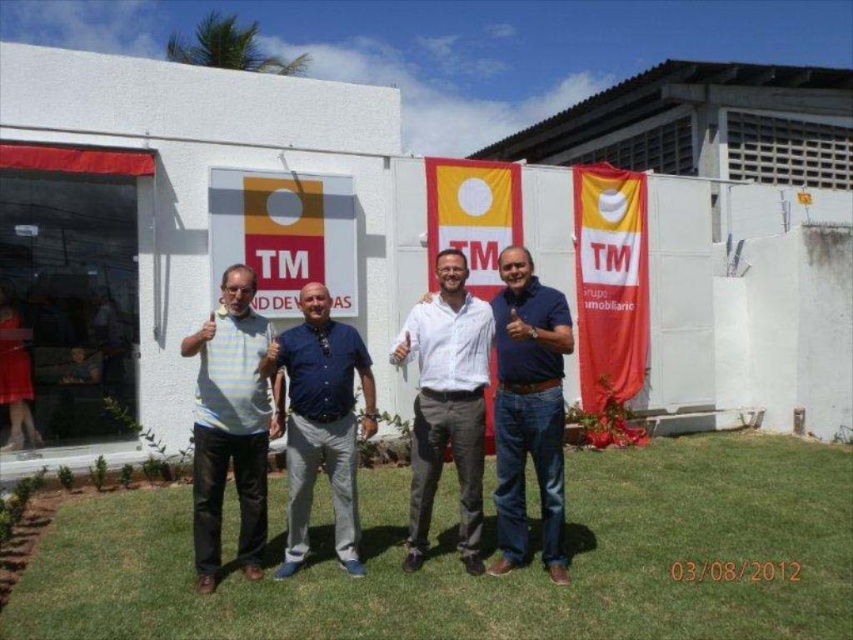
In the scene shown: Can you confirm if green grass at lower center is taller than white shirt at center?

In fact, green grass at lower center may be shorter than white shirt at center.

Who is more forward, (x=848, y=618) or (x=561, y=534)?

Point (x=848, y=618) is in front.

Image resolution: width=853 pixels, height=640 pixels. Identify the location of green grass at lower center. (489, 577).

Between green grass at lower center and white cotton shirt at center, which one appears on the right side from the viewer's perspective?

From the viewer's perspective, green grass at lower center appears more on the right side.

Is point (90, 593) less distant than point (409, 500)?

Yes, point (90, 593) is in front of point (409, 500).

Which is in front, point (734, 580) or point (410, 340)?

Positioned in front is point (734, 580).

At what (x,y) coordinates should I click in order to perform the action: click on green grass at lower center. Please return your answer as a coordinate pair (x, y). The image size is (853, 640). Looking at the image, I should click on (489, 577).

From the picture: Is striped cotton shirt at center bigger than white cotton shirt at center?

Indeed, striped cotton shirt at center has a larger size compared to white cotton shirt at center.

Who is more distant from viewer, (x=227, y=355) or (x=453, y=353)?

Point (x=453, y=353)

The image size is (853, 640). Find the location of `striped cotton shirt at center`. striped cotton shirt at center is located at coordinates click(x=231, y=426).

The width and height of the screenshot is (853, 640). In order to click on striped cotton shirt at center in this screenshot , I will do `click(231, 426)`.